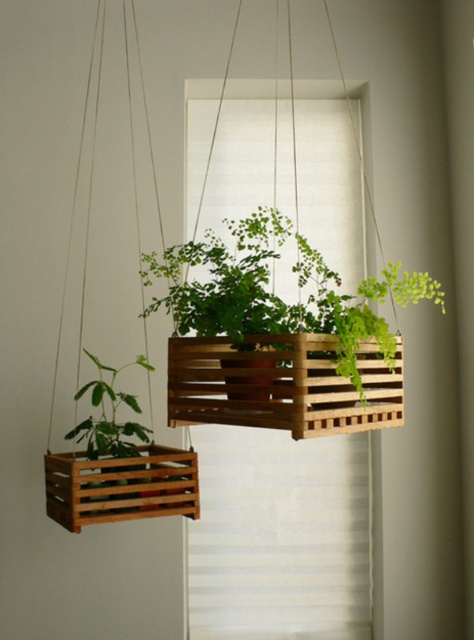
Does point (81, 474) come farther from viewer compared to point (76, 461)?

Yes, point (81, 474) is farther from viewer.

Can you confirm if wooden crate at center is positioned above brown wooden crate at left?

Yes.

Where is `wooden crate at center`? The width and height of the screenshot is (474, 640). wooden crate at center is located at coordinates (106, 456).

Which of these two, green wooden crate at center or brown wooden crate at left, stands taller?

Standing taller between the two is green wooden crate at center.

In the scene shown: Does green wooden crate at center have a greater width compared to brown wooden crate at left?

Yes.

Which is in front, point (340, 296) or point (152, 474)?

Point (340, 296) is more forward.

I want to click on green wooden crate at center, so click(x=276, y=296).

Is wooden slats at center to the left of green matte plant at left from the viewer's perspective?

Incorrect, wooden slats at center is not on the left side of green matte plant at left.

Can you confirm if wooden slats at center is positioned to the right of green matte plant at left?

Correct, you'll find wooden slats at center to the right of green matte plant at left.

Who is more distant from viewer, (376,406) or (106,397)?

Point (106,397)

This screenshot has height=640, width=474. Identify the location of wooden slats at center. (282, 385).